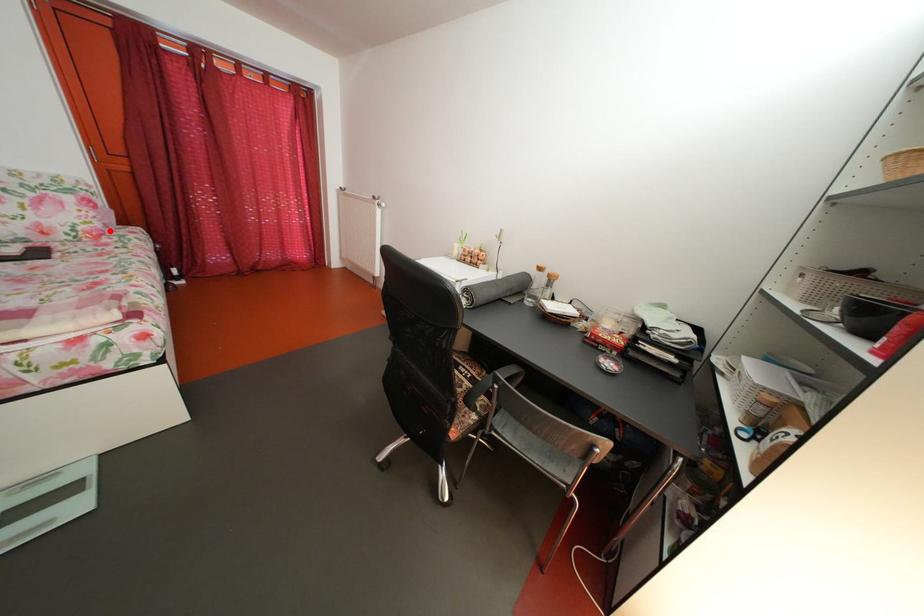
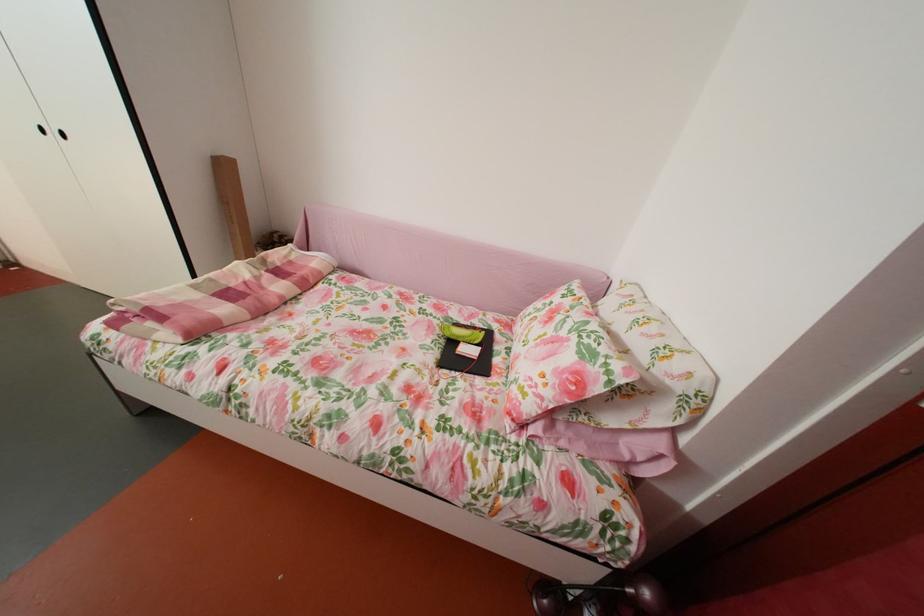
Question: I am providing you with two images of the same scene from different viewpoints. Given a red point in image1, look at the same physical point in image2. Is it:

Choices:
 (A) Closer to the viewpoint
 (B) Farther from the viewpoint

Answer: (A)